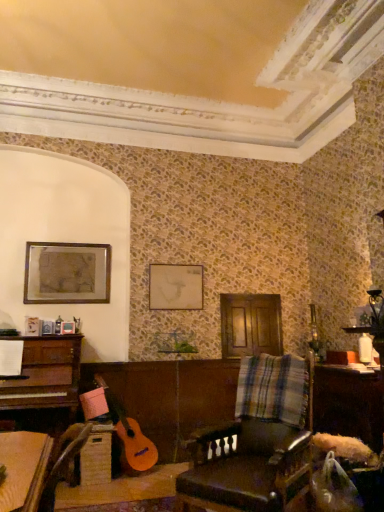
Question: Is matte white picture frame at center, which ranks as the 2th picture frame in left-to-right order, with matte gold picture frame at upper left, which is the 2th picture frame from right to left?

Choices:
 (A) no
 (B) yes

Answer: (A)

Question: Can you confirm if matte white picture frame at center, the 1th picture frame from the right, is smaller than matte gold picture frame at upper left, which ranks as the first picture frame in left-to-right order?

Choices:
 (A) yes
 (B) no

Answer: (A)

Question: Could you tell me if matte white picture frame at center, which ranks as the 2th picture frame in left-to-right order, is turned towards matte gold picture frame at upper left, which ranks as the first picture frame in left-to-right order?

Choices:
 (A) yes
 (B) no

Answer: (B)

Question: Can you confirm if matte white picture frame at center, the 1th picture frame from the right, is taller than matte gold picture frame at upper left, which ranks as the first picture frame in left-to-right order?

Choices:
 (A) yes
 (B) no

Answer: (B)

Question: Considering the relative sizes of matte white picture frame at center, which ranks as the 2th picture frame in left-to-right order, and matte gold picture frame at upper left, which ranks as the first picture frame in left-to-right order, in the image provided, is matte white picture frame at center, which ranks as the 2th picture frame in left-to-right order, shorter than matte gold picture frame at upper left, which ranks as the first picture frame in left-to-right order,?

Choices:
 (A) yes
 (B) no

Answer: (A)

Question: From the image's perspective, is wooden table at lower right above or below leather at center?

Choices:
 (A) above
 (B) below

Answer: (B)

Question: Looking at the image, does wooden table at lower right seem bigger or smaller compared to leather at center?

Choices:
 (A) big
 (B) small

Answer: (B)

Question: Is wooden table at lower right in front of or behind leather at center in the image?

Choices:
 (A) behind
 (B) front

Answer: (A)

Question: Based on their positions, is wooden table at lower right located to the left or right of leather at center?

Choices:
 (A) right
 (B) left

Answer: (A)

Question: In the image, is wooden table at lower right on the left side or the right side of matte white picture frame at center, which ranks as the 2th picture frame in left-to-right order?

Choices:
 (A) left
 (B) right

Answer: (B)

Question: Considering their positions, is wooden table at lower right located in front of or behind matte white picture frame at center, which ranks as the 2th picture frame in left-to-right order?

Choices:
 (A) front
 (B) behind

Answer: (A)

Question: From the image's perspective, is wooden table at lower right positioned above or below matte white picture frame at center, which ranks as the 2th picture frame in left-to-right order?

Choices:
 (A) below
 (B) above

Answer: (A)

Question: Considering the positions of point (347, 392) and point (190, 278), is point (347, 392) closer or farther from the camera than point (190, 278)?

Choices:
 (A) farther
 (B) closer

Answer: (B)

Question: From their relative heights in the image, would you say matte gold picture frame at upper left, which is the 2th picture frame from right to left, is taller or shorter than leather at center?

Choices:
 (A) tall
 (B) short

Answer: (B)

Question: Considering their positions, is matte gold picture frame at upper left, which is the 2th picture frame from right to left, located in front of or behind leather at center?

Choices:
 (A) front
 (B) behind

Answer: (B)